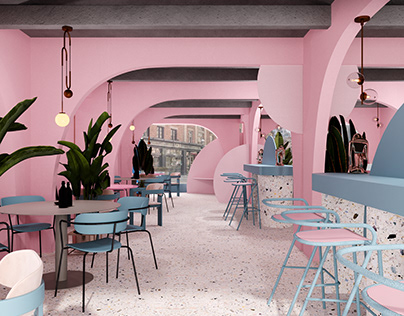
The height and width of the screenshot is (316, 404). Find the location of `beam`. beam is located at coordinates (221, 18), (221, 75), (221, 103).